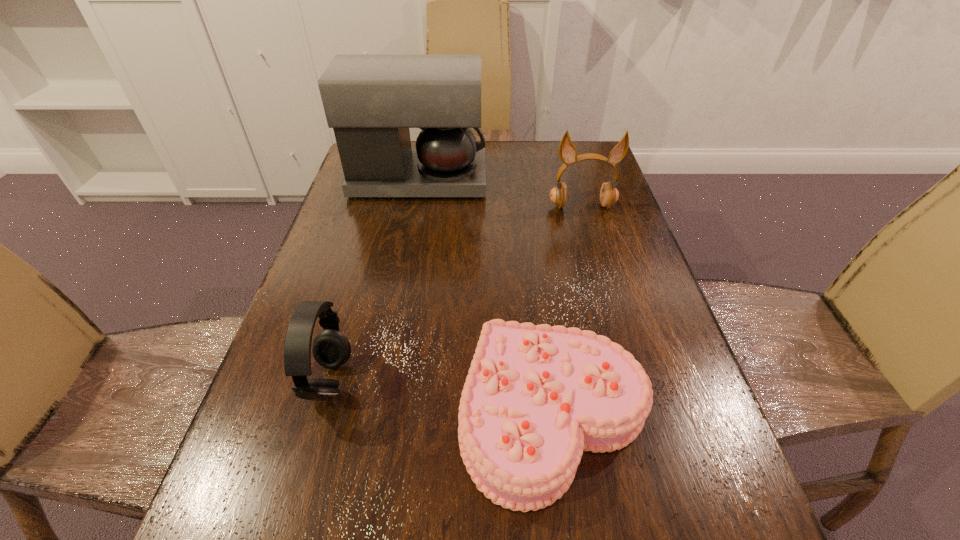
Identify the location of vacant region between the shorter earphone and the coffee maker. This screenshot has height=540, width=960. (374, 282).

This screenshot has width=960, height=540. What are the coordinates of `free point between the nearer earphone and the coffee maker` in the screenshot? It's located at (374, 282).

You are a GUI agent. You are given a task and a screenshot of the screen. Output one action in this format:
    pyautogui.click(x=<x>, y=<y>)
    Task: Click on the vacant area between the cake and the tallest object
    
    Given the screenshot: What is the action you would take?
    pyautogui.click(x=486, y=298)

Locate an element on the screen. This screenshot has height=540, width=960. free point between the taller earphone and the shorter earphone is located at coordinates (456, 294).

Where is `free space between the coffee maker and the shortest object`? free space between the coffee maker and the shortest object is located at coordinates (486, 298).

Where is `unoccupied area between the taller earphone and the tallest object`? Image resolution: width=960 pixels, height=540 pixels. unoccupied area between the taller earphone and the tallest object is located at coordinates (500, 194).

Find the location of `vacant area that lies between the tallest object and the right earphone`. vacant area that lies between the tallest object and the right earphone is located at coordinates (500, 194).

Find the location of a particular element. free space between the shortest object and the coffee maker is located at coordinates (486, 298).

In order to click on blank region between the cake and the right earphone in this screenshot , I will do `click(567, 310)`.

Find the location of `object that can be found as the closest to the nearer earphone`. object that can be found as the closest to the nearer earphone is located at coordinates click(535, 397).